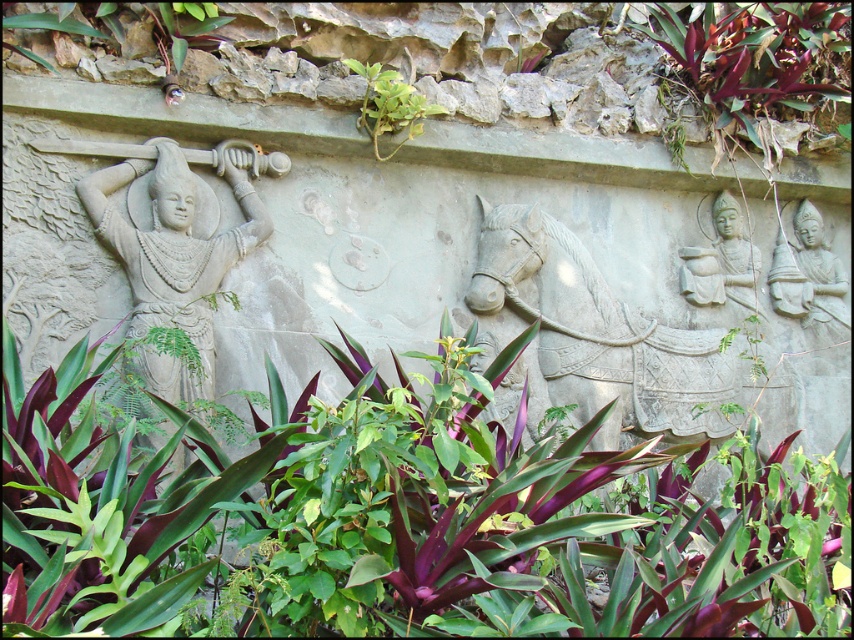
Does gray stone statue at left appear on the right side of green leafy plant at upper center?

In fact, gray stone statue at left is to the left of green leafy plant at upper center.

Is gray stone statue at left bigger than green leafy plant at upper center?

Yes.

Is point (177, 204) behind point (358, 120)?

That is False.

Identify the location of gray stone statue at left. This screenshot has width=854, height=640. (174, 250).

Which is above, purple leafy plant at center or gray stone statue at upper right?

gray stone statue at upper right is higher up.

Is purple leafy plant at center closer to camera compared to gray stone statue at upper right?

That is True.

The width and height of the screenshot is (854, 640). In order to click on purple leafy plant at center in this screenshot , I will do `click(401, 516)`.

Identify the location of purple leafy plant at center. The width and height of the screenshot is (854, 640). (401, 516).

Consider the image. Does purple leafy plant at upper right come in front of purple leafy plant at upper left?

No, purple leafy plant at upper right is further to the viewer.

Between purple leafy plant at upper right and purple leafy plant at upper left, which one appears on the right side from the viewer's perspective?

purple leafy plant at upper right

Is point (816, 22) closer to viewer compared to point (161, 51)?

No, it is not.

The image size is (854, 640). I want to click on purple leafy plant at upper right, so click(756, 60).